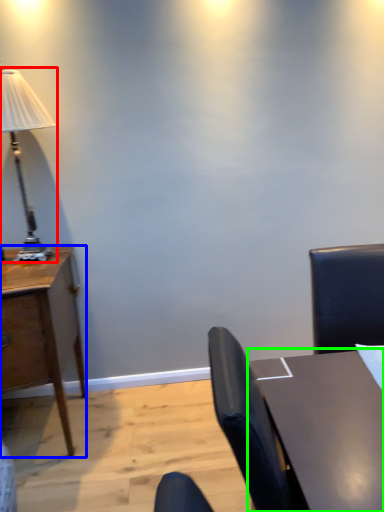
Question: Which object is positioned farthest from lamp (highlighted by a red box)? Select from desk (highlighted by a blue box) and table (highlighted by a green box).

Choices:
 (A) desk
 (B) table

Answer: (B)